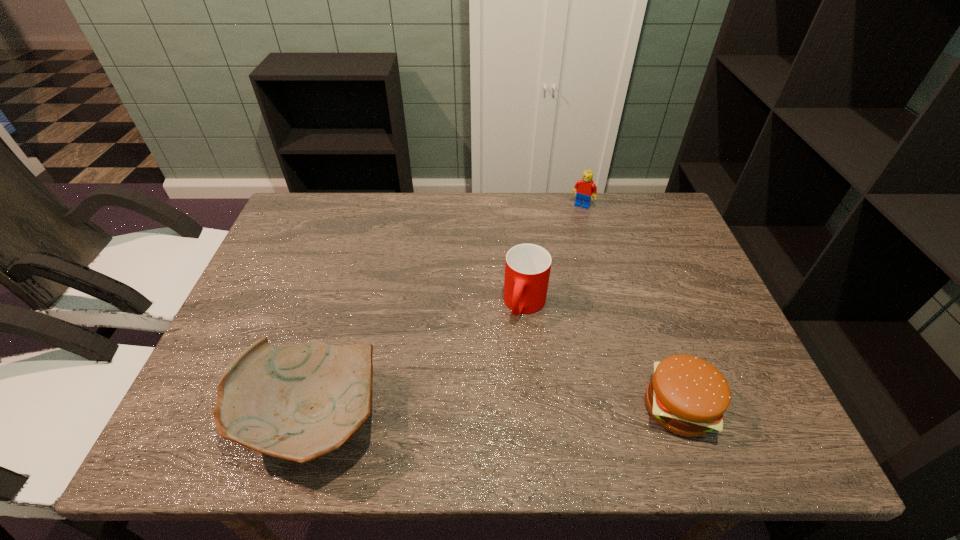
This screenshot has width=960, height=540. In order to click on free space located 0.340m on the face of the Lego in this screenshot , I will do (x=539, y=278).

I want to click on free spot located 0.300m on the face of the Lego, so click(x=544, y=268).

The image size is (960, 540). I want to click on vacant space situated 0.190m on the face of the Lego, so click(558, 245).

The width and height of the screenshot is (960, 540). Identify the location of object located in the far edge section of the desktop. (584, 188).

I want to click on pottery situated at the near edge, so click(x=299, y=403).

Where is `hamburger that is at the near edge`? hamburger that is at the near edge is located at coordinates (688, 396).

This screenshot has width=960, height=540. Find the location of `object that is at the left edge`. object that is at the left edge is located at coordinates (299, 403).

What are the coordinates of `object that is at the right edge` in the screenshot? It's located at (688, 396).

In order to click on object present at the near left corner in this screenshot , I will do `click(299, 403)`.

Locate an element on the screen. The width and height of the screenshot is (960, 540). object that is at the near right corner is located at coordinates (688, 396).